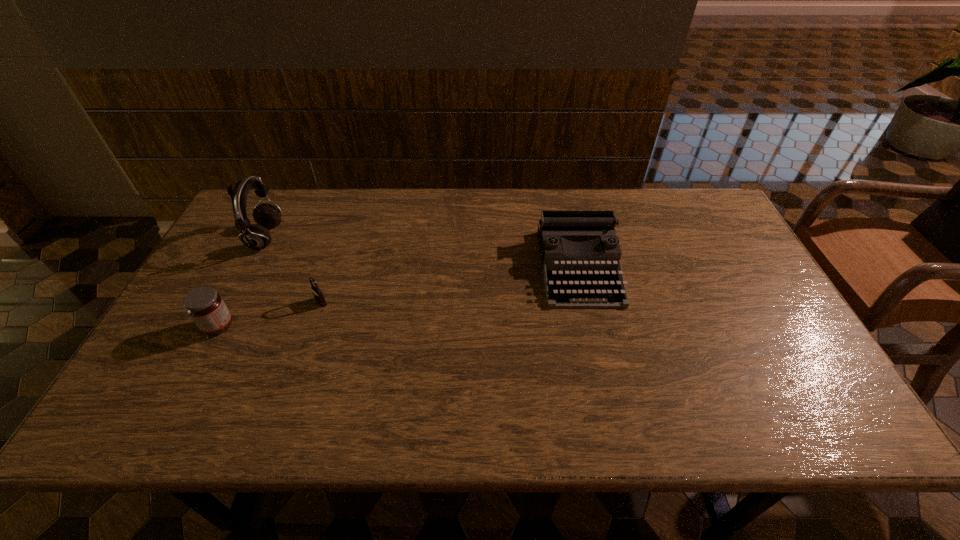
Locate an element on the screen. This screenshot has height=540, width=960. vacant point that satisfies the following two spatial constraints: 1. on the ear pads of the earphone; 2. on the back side of the padlock is located at coordinates (233, 302).

Find the location of a particular element. This screenshot has width=960, height=540. vacant area in the image that satisfies the following two spatial constraints: 1. on the back side of the nearest object; 2. on the right side of the second object from right to left is located at coordinates (231, 302).